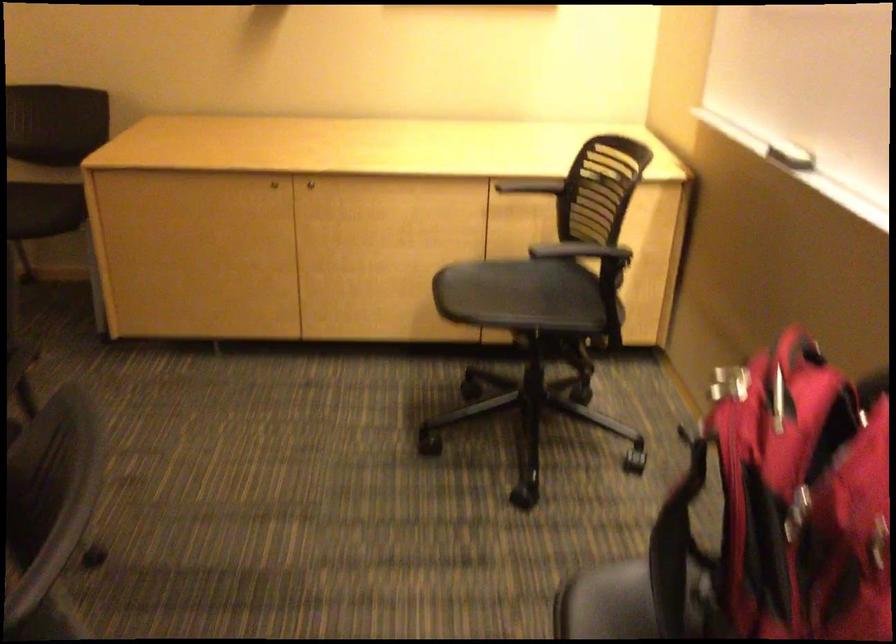
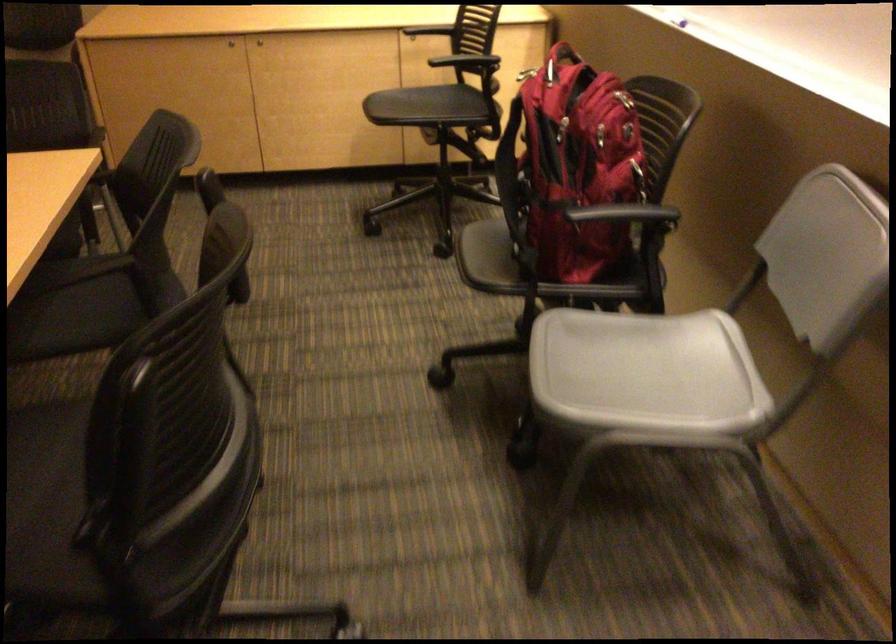
Find the pixel in the second image that matches the point at 800,516 in the first image.

(564, 127)